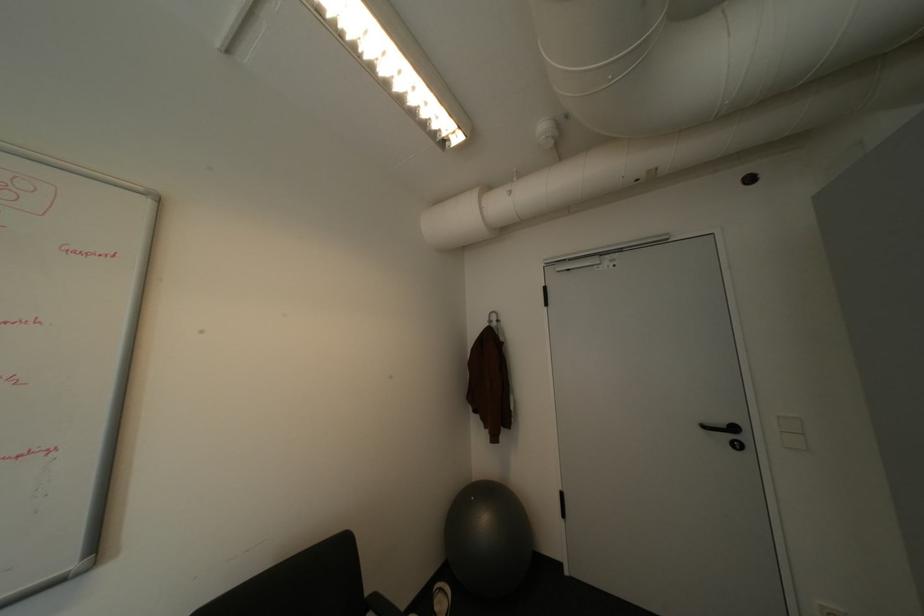
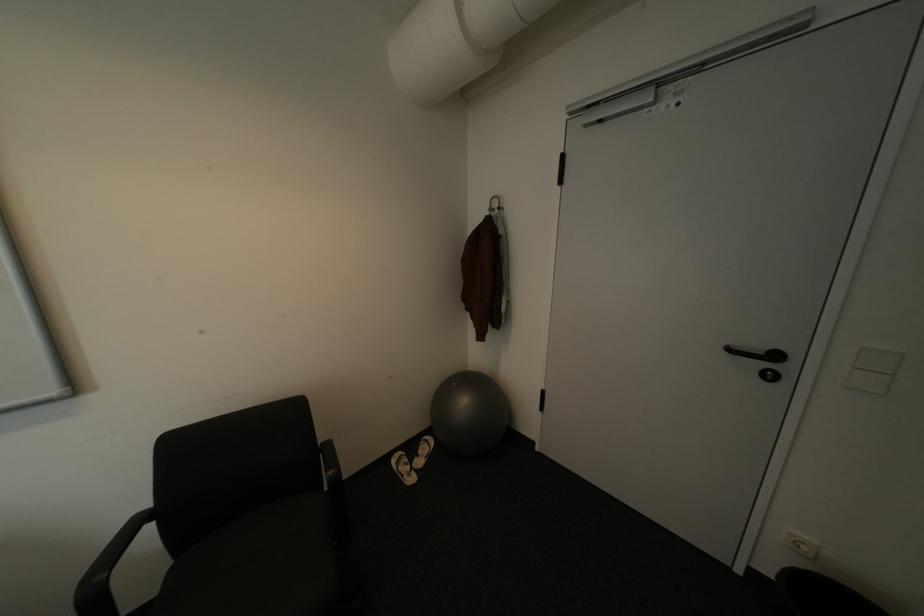
In the second image, find the point that corresponds to (482,498) in the first image.

(464, 384)